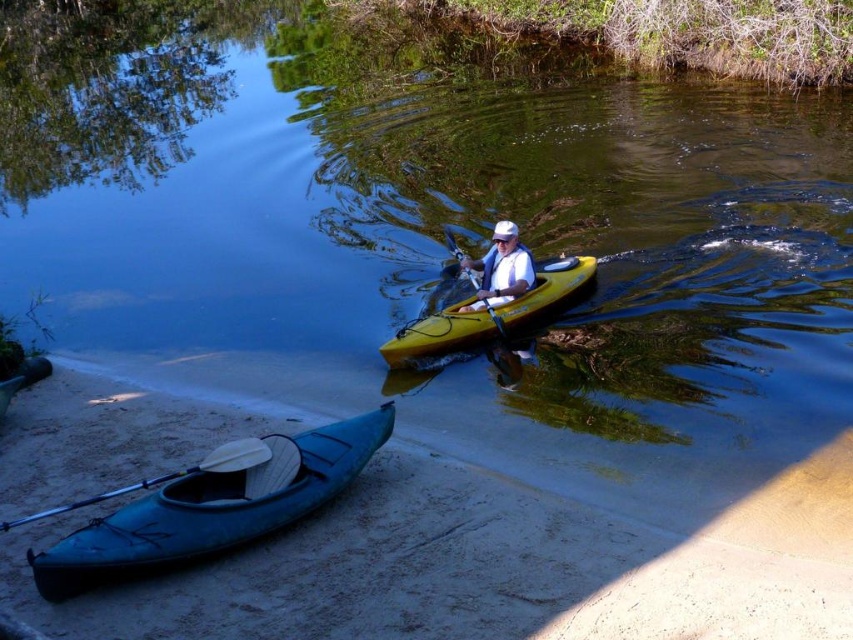
Is teal plastic canoe at lower left further to camera compared to matte yellow kayak at center?

That is False.

Does teal plastic canoe at lower left have a lesser height compared to matte yellow kayak at center?

Incorrect, teal plastic canoe at lower left's height does not fall short of matte yellow kayak at center's.

The image size is (853, 640). I want to click on teal plastic canoe at lower left, so click(x=213, y=508).

Is sandy shore at lower left further to the viewer compared to white foam paddle at lower left?

That is False.

Is sandy shore at lower left to the right of white foam paddle at lower left from the viewer's perspective?

Yes, sandy shore at lower left is to the right of white foam paddle at lower left.

Who is more forward, (378, 506) or (250, 467)?

Point (250, 467)

The image size is (853, 640). Find the location of `sandy shore at lower left`. sandy shore at lower left is located at coordinates (474, 570).

Is teal plastic canoe at lower left further to the viewer compared to white foam paddle at lower left?

No, teal plastic canoe at lower left is closer to the viewer.

Locate an element on the screen. The height and width of the screenshot is (640, 853). teal plastic canoe at lower left is located at coordinates (213, 508).

At what (x,y) coordinates should I click in order to perform the action: click on teal plastic canoe at lower left. Please return your answer as a coordinate pair (x, y). Looking at the image, I should click on (213, 508).

This screenshot has height=640, width=853. What are the coordinates of `teal plastic canoe at lower left` in the screenshot? It's located at (213, 508).